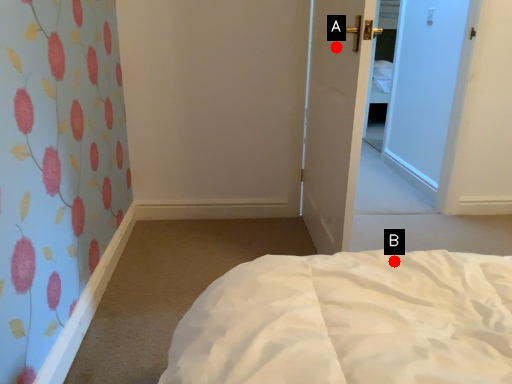
Question: Two points are circled on the image, labeled by A and B beside each circle. Which point is closer to the camera taking this photo?

Choices:
 (A) A is closer
 (B) B is closer

Answer: (B)